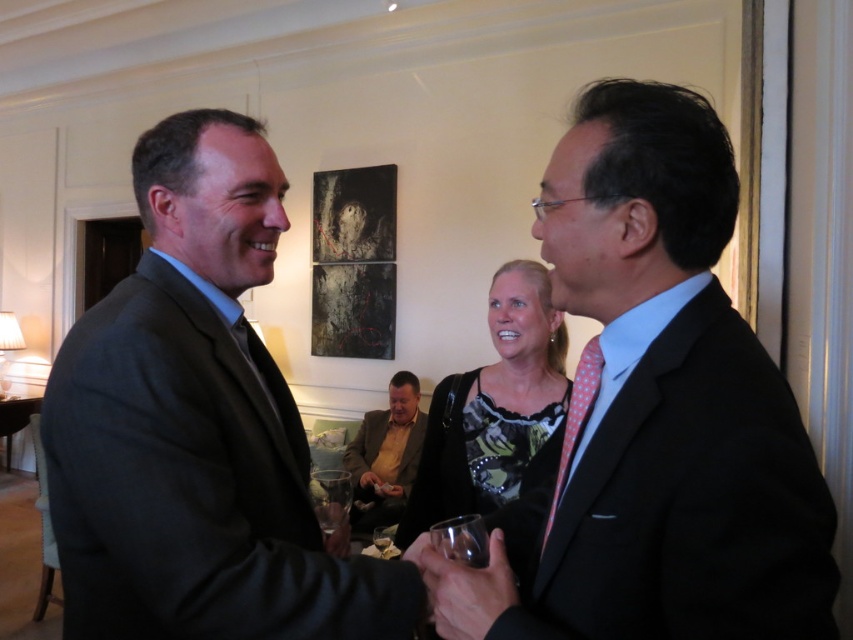
You are a photographer at the event and want to capture a photo of the two people in the foreground. You notice the pink dotted tie at center and the matte black hand at center. Which object should be placed to the left in the frame to ensure proper composition?

The matte black hand at center should be placed to the left in the frame because the pink dotted tie at center is to the right of the matte black hand at center.

You are standing at the entrance of the event and want to locate the dark gray suit at left and the metallic silver cup at center. Based on their positions, which one is higher up in the image?

The dark gray suit at left is above the metallic silver cup at center in the image.